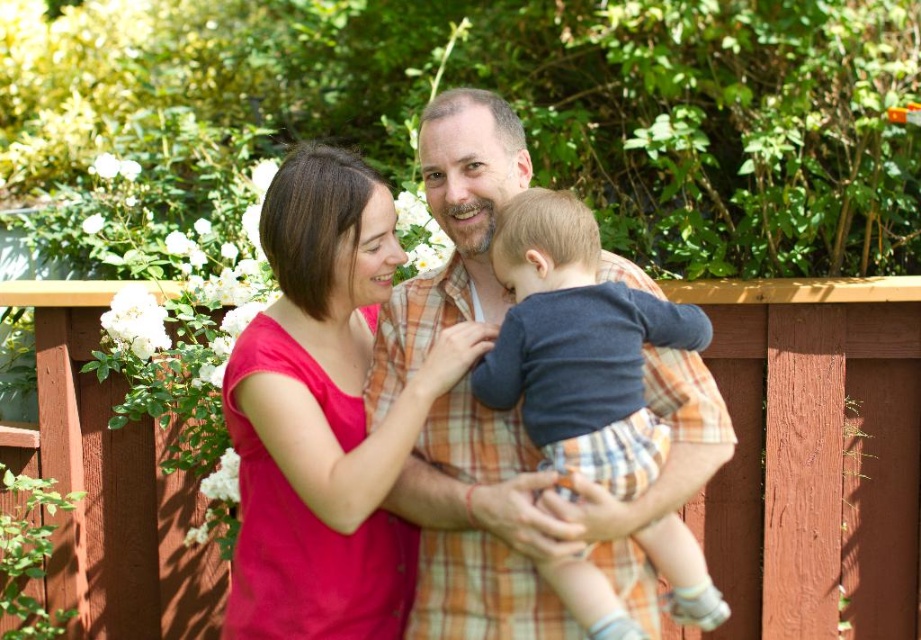
Question: Which object is closer to the camera taking this photo?

Choices:
 (A) wooden fence at center
 (B) dark blue cotton shirt at center
 (C) matte orange plaid shirt at center
 (D) matte pink shirt at center

Answer: (B)

Question: Is matte pink shirt at center above dark blue cotton shirt at center?

Choices:
 (A) yes
 (B) no

Answer: (A)

Question: Does wooden fence at center appear on the left side of matte orange plaid shirt at center?

Choices:
 (A) no
 (B) yes

Answer: (A)

Question: Which of the following is the closest to the observer?

Choices:
 (A) matte orange plaid shirt at center
 (B) matte pink shirt at center
 (C) wooden fence at center
 (D) dark blue cotton shirt at center

Answer: (D)

Question: Observing the image, what is the correct spatial positioning of wooden fence at center in reference to matte pink shirt at center?

Choices:
 (A) above
 (B) below

Answer: (B)

Question: Which point is closer to the camera?

Choices:
 (A) matte pink shirt at center
 (B) matte orange plaid shirt at center

Answer: (B)